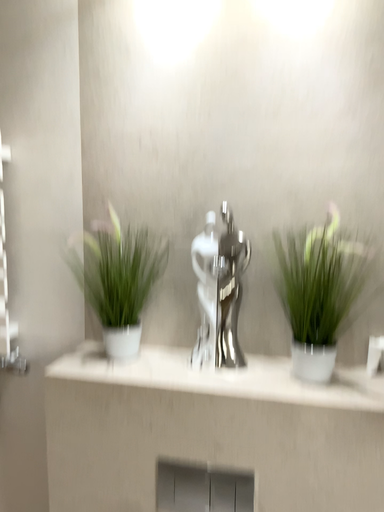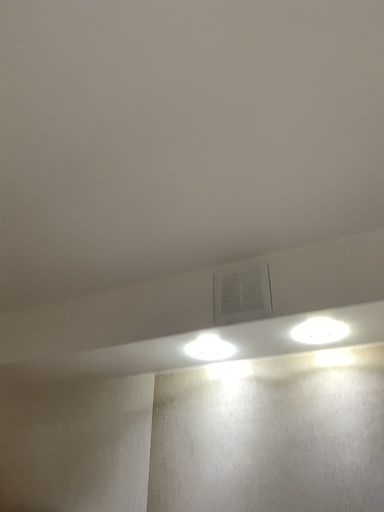
Question: How did the camera likely rotate when shooting the video?

Choices:
 (A) rotated upward
 (B) rotated downward

Answer: (A)